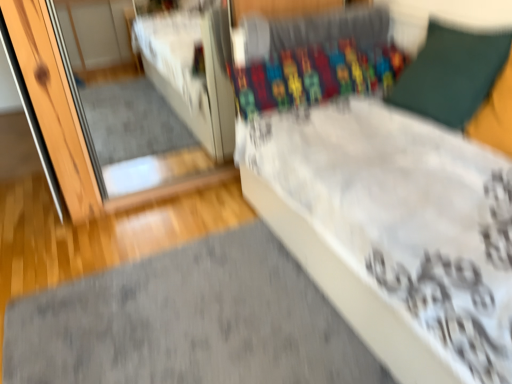
Question: Is the surface of white glossy mirror at upper left in direct contact with gray soft mat at lower left?

Choices:
 (A) no
 (B) yes

Answer: (A)

Question: From a real-world perspective, is white glossy mirror at upper left physically above gray soft mat at lower left?

Choices:
 (A) yes
 (B) no

Answer: (A)

Question: Considering the relative sizes of white glossy mirror at upper left and gray soft mat at lower left in the image provided, is white glossy mirror at upper left smaller than gray soft mat at lower left?

Choices:
 (A) yes
 (B) no

Answer: (B)

Question: From the image's perspective, would you say white glossy mirror at upper left is shown under gray soft mat at lower left?

Choices:
 (A) yes
 (B) no

Answer: (B)

Question: Is white glossy mirror at upper left positioned far away from gray soft mat at lower left?

Choices:
 (A) yes
 (B) no

Answer: (A)

Question: Visually, is gray soft mat at lower left positioned to the left or to the right of green fabric pillow at upper right?

Choices:
 (A) left
 (B) right

Answer: (A)

Question: Is gray soft mat at lower left bigger or smaller than green fabric pillow at upper right?

Choices:
 (A) small
 (B) big

Answer: (A)

Question: From the image's perspective, relative to green fabric pillow at upper right, is gray soft mat at lower left above or below?

Choices:
 (A) above
 (B) below

Answer: (B)

Question: Choose the correct answer: Is gray soft mat at lower left inside green fabric pillow at upper right or outside it?

Choices:
 (A) outside
 (B) inside

Answer: (A)

Question: Looking at their shapes, would you say green fabric pillow at upper right is wider or thinner than gray soft mat at lower left?

Choices:
 (A) wide
 (B) thin

Answer: (B)

Question: Considering the positions of green fabric pillow at upper right and gray soft mat at lower left in the image, is green fabric pillow at upper right taller or shorter than gray soft mat at lower left?

Choices:
 (A) tall
 (B) short

Answer: (A)

Question: Is point (484, 84) closer or farther from the camera than point (165, 292)?

Choices:
 (A) farther
 (B) closer

Answer: (B)

Question: Is green fabric pillow at upper right to the left or to the right of gray soft mat at lower left in the image?

Choices:
 (A) right
 (B) left

Answer: (A)

Question: Is white glossy mirror at upper left spatially inside green fabric pillow at upper right, or outside of it?

Choices:
 (A) inside
 (B) outside

Answer: (B)

Question: Considering the positions of point (165, 160) and point (398, 91), is point (165, 160) closer or farther from the camera than point (398, 91)?

Choices:
 (A) farther
 (B) closer

Answer: (A)